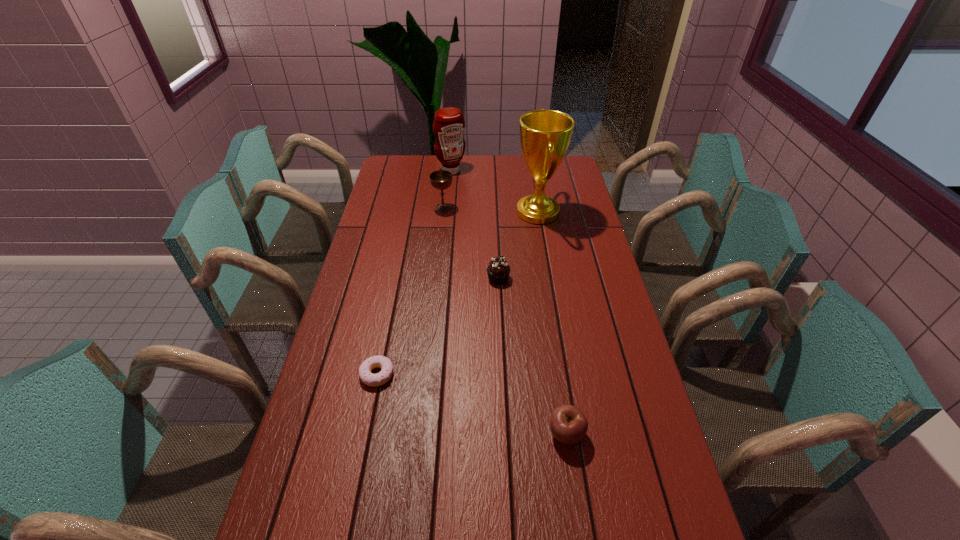
This screenshot has height=540, width=960. I want to click on vacant region at the far edge of the desktop, so click(x=478, y=175).

Where is `free space at the left edge`? This screenshot has height=540, width=960. free space at the left edge is located at coordinates (385, 300).

Image resolution: width=960 pixels, height=540 pixels. Find the location of `vacant area at the right edge of the desktop`. vacant area at the right edge of the desktop is located at coordinates (583, 220).

The image size is (960, 540). In order to click on vacant space at the far left corner of the desktop in this screenshot , I will do `click(410, 170)`.

Where is `free space between the third tallest object and the second tallest object`? Image resolution: width=960 pixels, height=540 pixels. free space between the third tallest object and the second tallest object is located at coordinates (447, 190).

Image resolution: width=960 pixels, height=540 pixels. What are the coordinates of `free space that is in between the tallest object and the fourth farthest object` in the screenshot? It's located at (518, 245).

Locate an element on the screen. This screenshot has width=960, height=540. unoccupied area between the tallest object and the apple is located at coordinates (552, 323).

Identify the location of free space between the second nearest object and the apple. The height and width of the screenshot is (540, 960). (471, 404).

Where is `unoccupied position between the farthest object and the fourth object from left to right`? unoccupied position between the farthest object and the fourth object from left to right is located at coordinates (474, 225).

This screenshot has height=540, width=960. Find the location of `vacant area between the tallest object and the condiment`. vacant area between the tallest object and the condiment is located at coordinates (494, 192).